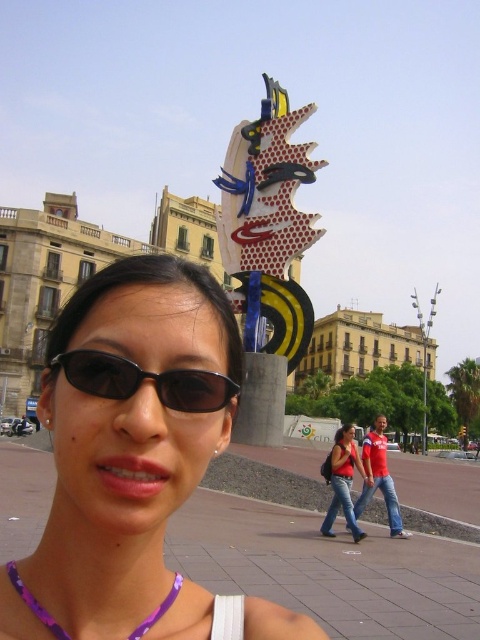
You are a photographer trying to capture the artistic sculpture in the background while ensuring the person in the foreground is clearly visible. Which object, the matte black sunglasses at center or the black matte sunglasses at center, should you focus on to ensure the person is in focus?

The matte black sunglasses at center is much taller than the black matte sunglasses at center, so focusing on the taller matte black sunglasses at center would ensure the person in the foreground is in focus.

You are a photographer trying to capture the perfect shot of the red fabric shirt at center and the purple beaded necklace at lower center. Which object should you focus on first if you want to start with the one closer to the left side?

The purple beaded necklace at lower center is closer to the left side, so you should focus on it first.